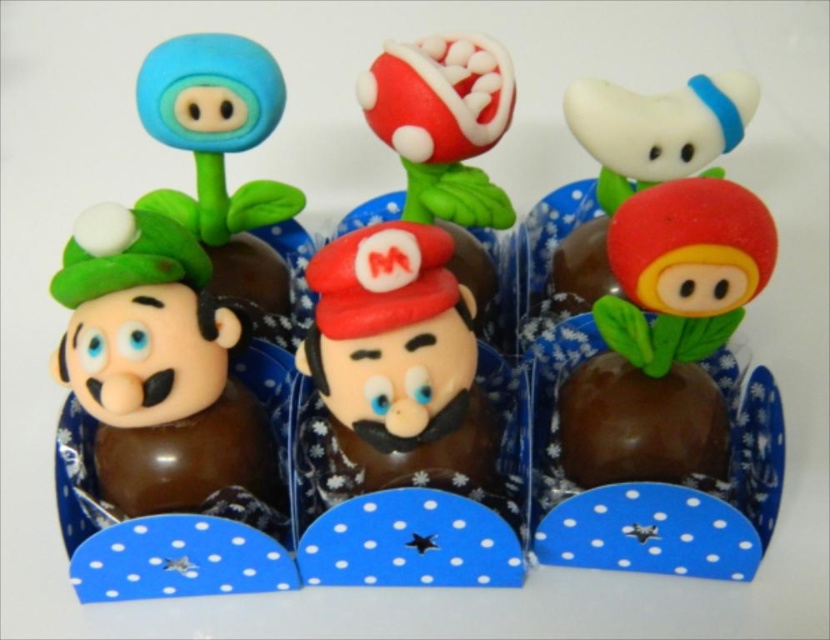
You are a child who wants to eat the largest decoration on the left treat. Which decoration should you choose between the matte blue flower at upper left and the white matte mushroom at center?

The white matte mushroom at center is larger than the matte blue flower at upper left, so you should choose the white matte mushroom at center.

You are holding a small toy that needs to be placed on the table where the matte chocolate figurine at center and the white matte mushroom at center are located. Which object should you place the toy closer to if you want it to be nearer to the viewer?

You should place the toy closer to the matte chocolate figurine at center because it is already closer to the viewer than the white matte mushroom at center.